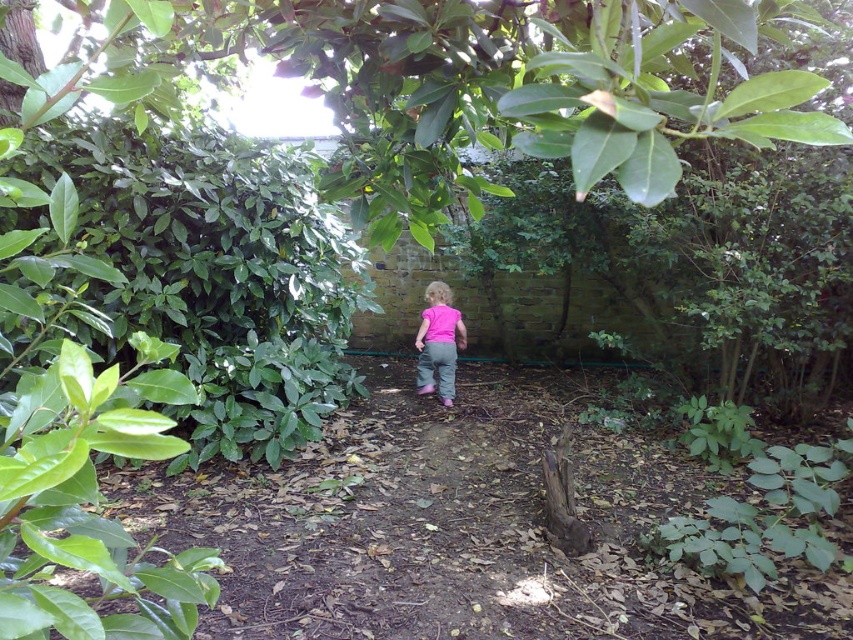
Question: Is green leafy tree at upper center bigger than pink fabric at center?

Choices:
 (A) no
 (B) yes

Answer: (B)

Question: Is green leafy tree at upper center thinner than pink fabric at center?

Choices:
 (A) yes
 (B) no

Answer: (B)

Question: Can you confirm if green leafy tree at upper center is smaller than pink fabric at center?

Choices:
 (A) yes
 (B) no

Answer: (B)